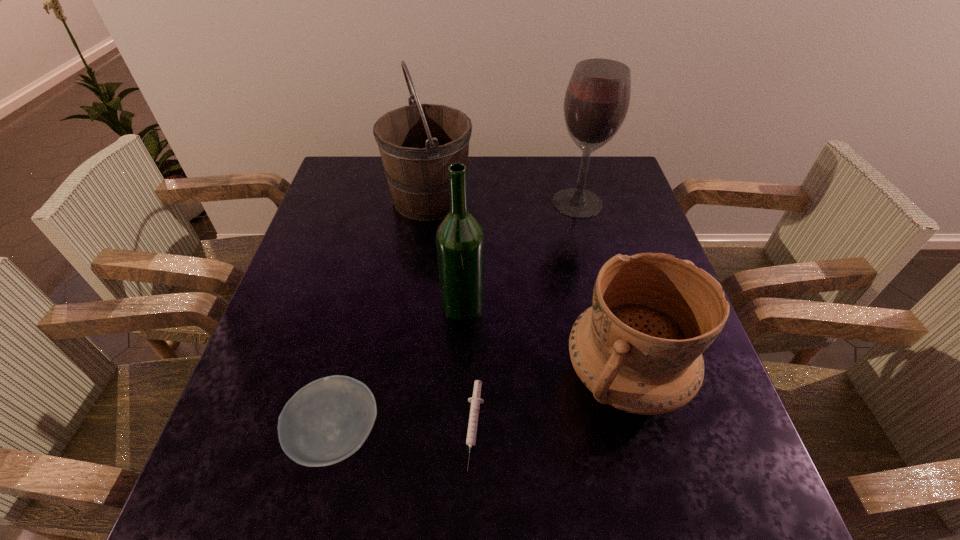
Where is `bucket`? The image size is (960, 540). bucket is located at coordinates (x=417, y=143).

The width and height of the screenshot is (960, 540). Find the location of `the farther alcohol`. the farther alcohol is located at coordinates (596, 102).

Locate an element on the screen. Image resolution: width=960 pixels, height=540 pixels. the fourth nearest object is located at coordinates (460, 241).

You are a GUI agent. You are given a task and a screenshot of the screen. Output one action in this format:
    pyautogui.click(x=<x>, y=<y>)
    Task: Click on the left alcohol
    This screenshot has height=540, width=960.
    Given the screenshot: What is the action you would take?
    pyautogui.click(x=460, y=241)

Locate an element on the screen. pottery is located at coordinates [x=638, y=348].

Identify the location of the second shortest object. This screenshot has height=540, width=960. (328, 420).

The height and width of the screenshot is (540, 960). What are the coordinates of `syringe` in the screenshot? It's located at (475, 401).

Identify the location of vacant region located on the right of the bucket. Image resolution: width=960 pixels, height=540 pixels. (497, 198).

You are a GUI agent. You are given a task and a screenshot of the screen. Output one action in this format:
    pyautogui.click(x=<x>, y=<y>)
    Task: Click on the vacant space located on the front of the farther alcohol
    
    Given the screenshot: What is the action you would take?
    pyautogui.click(x=597, y=282)

You are a GUI agent. You are given a task and a screenshot of the screen. Output one action in this format:
    pyautogui.click(x=<x>, y=<y>)
    Task: Click on the free location located 0.220m on the right of the nearer alcohol
    Image resolution: width=960 pixels, height=540 pixels.
    Given the screenshot: What is the action you would take?
    pyautogui.click(x=580, y=304)